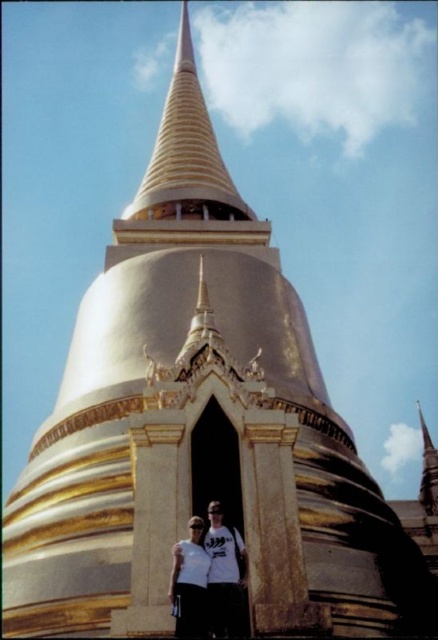
Question: Can you confirm if gold polished spire at center is positioned to the left of white matte t-shirt at lower center?

Choices:
 (A) no
 (B) yes

Answer: (B)

Question: Is gold polished spire at center closer to camera compared to white matte t-shirt at lower center?

Choices:
 (A) no
 (B) yes

Answer: (A)

Question: Which object is closer to the camera taking this photo?

Choices:
 (A) white matte t-shirt at lower center
 (B) gold polished spire at center

Answer: (A)

Question: Which point is closer to the camera?

Choices:
 (A) (207, 157)
 (B) (201, 547)

Answer: (B)

Question: Is gold polished spire at center above white matte t-shirt at lower center?

Choices:
 (A) no
 (B) yes

Answer: (B)

Question: Which point is closer to the camera?

Choices:
 (A) (195, 124)
 (B) (226, 589)

Answer: (B)